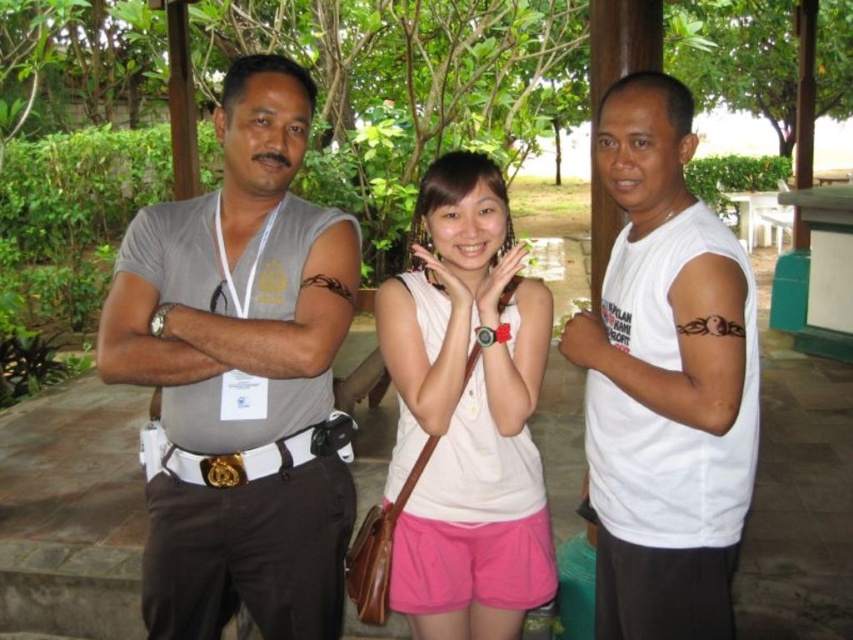
You are standing at point (x=410, y=390) and want to walk to point (x=283, y=605). Which direction should you move in relation to the two points?

You should move behind point (x=410, y=390) towards point (x=283, y=605) because point (x=283, y=605) is located behind point (x=410, y=390) from your current position.